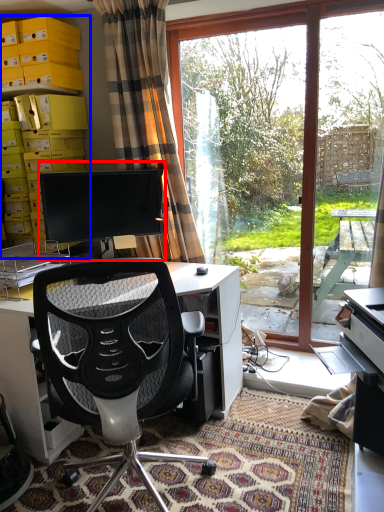
Question: Among these objects, which one is nearest to the camera, computer monitor (highlighted by a red box) or shelf (highlighted by a blue box)?

Choices:
 (A) computer monitor
 (B) shelf

Answer: (A)